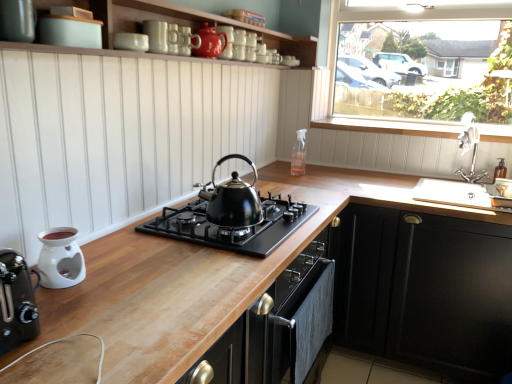
The height and width of the screenshot is (384, 512). I want to click on empty space that is in between clear glass spray bottle at upper center, the 2th appliance ordered from the bottom, and silver metallic faucet at upper right, so click(391, 178).